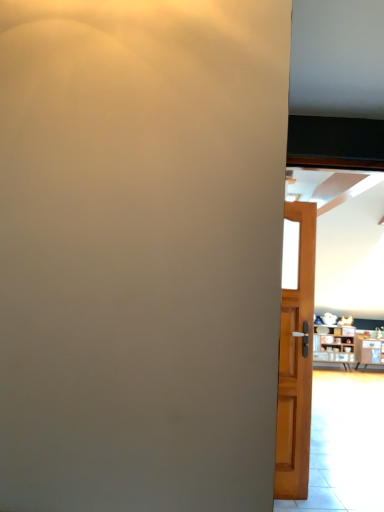
This screenshot has height=512, width=384. In order to click on light brown wooden door at right in this screenshot , I will do `click(295, 352)`.

Describe the element at coordinates (295, 352) in the screenshot. I see `light brown wooden door at right` at that location.

You are a GUI agent. You are given a task and a screenshot of the screen. Output one action in this format:
    pyautogui.click(x=<x>, y=<y>)
    Task: Click on the light brown wooden door at right
    This screenshot has width=384, height=512.
    Given the screenshot: What is the action you would take?
    pyautogui.click(x=295, y=352)